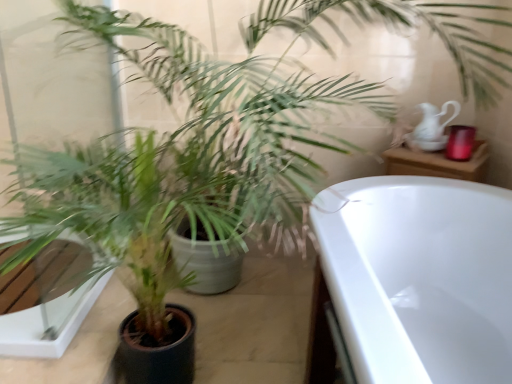
Question: Is green matte plant at center not inside white glossy pitcher at upper right?

Choices:
 (A) no
 (B) yes

Answer: (B)

Question: Considering the relative sizes of green matte plant at center and white glossy pitcher at upper right in the image provided, is green matte plant at center shorter than white glossy pitcher at upper right?

Choices:
 (A) yes
 (B) no

Answer: (B)

Question: Would you say green matte plant at center contains white glossy pitcher at upper right?

Choices:
 (A) no
 (B) yes

Answer: (A)

Question: Is green matte plant at center not close to white glossy pitcher at upper right?

Choices:
 (A) no
 (B) yes

Answer: (B)

Question: From the image's perspective, is green matte plant at center located beneath white glossy pitcher at upper right?

Choices:
 (A) yes
 (B) no

Answer: (A)

Question: Could you tell me if green matte plant at center is facing white glossy pitcher at upper right?

Choices:
 (A) no
 (B) yes

Answer: (A)

Question: Is white glossy pitcher at upper right thinner than green matte plant at center?

Choices:
 (A) yes
 (B) no

Answer: (A)

Question: Is white glossy pitcher at upper right closer to the viewer compared to green matte plant at center?

Choices:
 (A) no
 (B) yes

Answer: (A)

Question: Can you confirm if white glossy pitcher at upper right is bigger than green matte plant at center?

Choices:
 (A) no
 (B) yes

Answer: (A)

Question: Is white glossy pitcher at upper right behind green matte plant at center?

Choices:
 (A) yes
 (B) no

Answer: (A)

Question: Is white glossy pitcher at upper right touching green matte plant at center?

Choices:
 (A) yes
 (B) no

Answer: (B)

Question: From the image's perspective, does white glossy pitcher at upper right appear lower than green matte plant at center?

Choices:
 (A) no
 (B) yes

Answer: (A)

Question: Is white glossy pitcher at upper right inside the boundaries of green matte plant at center, or outside?

Choices:
 (A) outside
 (B) inside

Answer: (A)